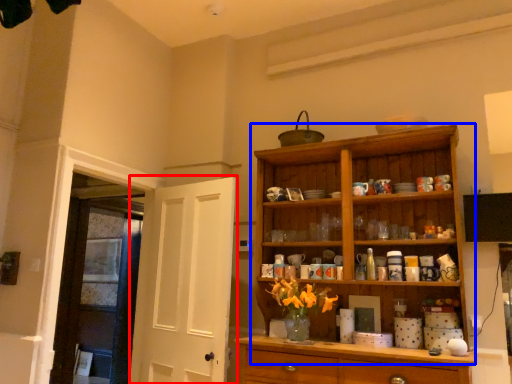
Question: Which object is closer to the camera taking this photo, door (highlighted by a red box) or cupboard (highlighted by a blue box)?

Choices:
 (A) door
 (B) cupboard

Answer: (B)